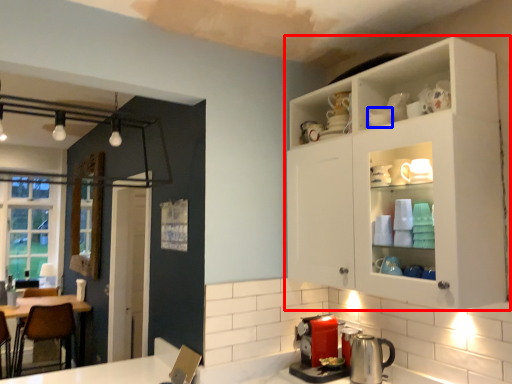
Question: Which point is closer to the camera, cabinetry (highlighted by a red box) or tableware (highlighted by a blue box)?

Choices:
 (A) cabinetry
 (B) tableware

Answer: (A)